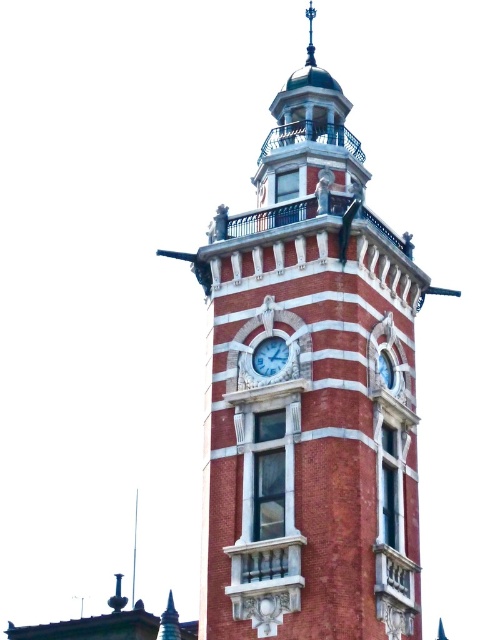
Is red brick clock tower at center taller than white marble clock at center?

Indeed, red brick clock tower at center has a greater height compared to white marble clock at center.

Between red brick clock tower at center and white marble clock at center, which one is positioned lower?

red brick clock tower at center

The image size is (480, 640). I want to click on red brick clock tower at center, so click(x=311, y=392).

The height and width of the screenshot is (640, 480). In order to click on red brick clock tower at center in this screenshot , I will do `click(311, 392)`.